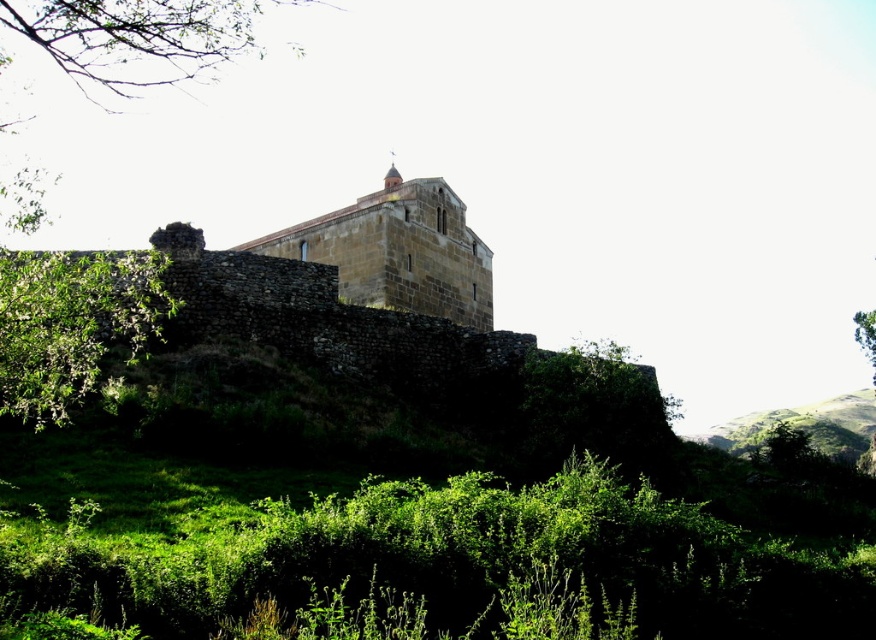
Question: Can you confirm if green leafy tree at upper left is positioned below green leafy tree at lower left?

Choices:
 (A) yes
 (B) no

Answer: (B)

Question: Which object is farther from the camera taking this photo?

Choices:
 (A) green leafy tree at upper left
 (B) green leafy tree at lower left
 (C) brown stone castle at center
 (D) green grassy hillside at upper right

Answer: (D)

Question: Is green leafy tree at upper left to the left of green grassy hillside at upper right from the viewer's perspective?

Choices:
 (A) no
 (B) yes

Answer: (B)

Question: Estimate the real-world distances between objects in this image. Which object is closer to the green leafy tree at lower left?

Choices:
 (A) brown stone castle at center
 (B) green grassy hillside at upper right
 (C) green leafy tree at upper left

Answer: (C)

Question: In this image, where is green leafy tree at upper left located relative to green grassy hillside at upper right?

Choices:
 (A) left
 (B) right

Answer: (A)

Question: Which object appears farthest from the camera in this image?

Choices:
 (A) brown stone castle at center
 (B) green leafy tree at lower left

Answer: (A)